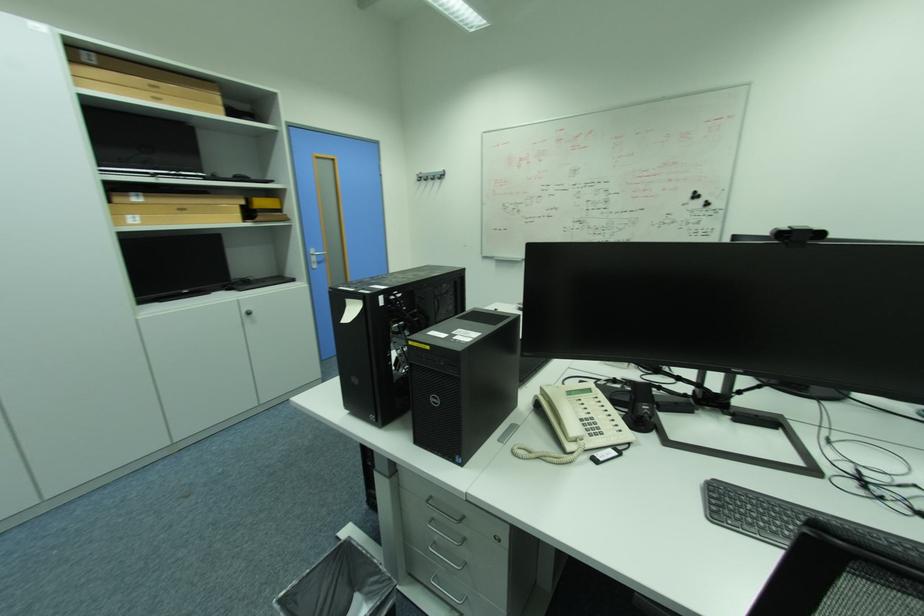
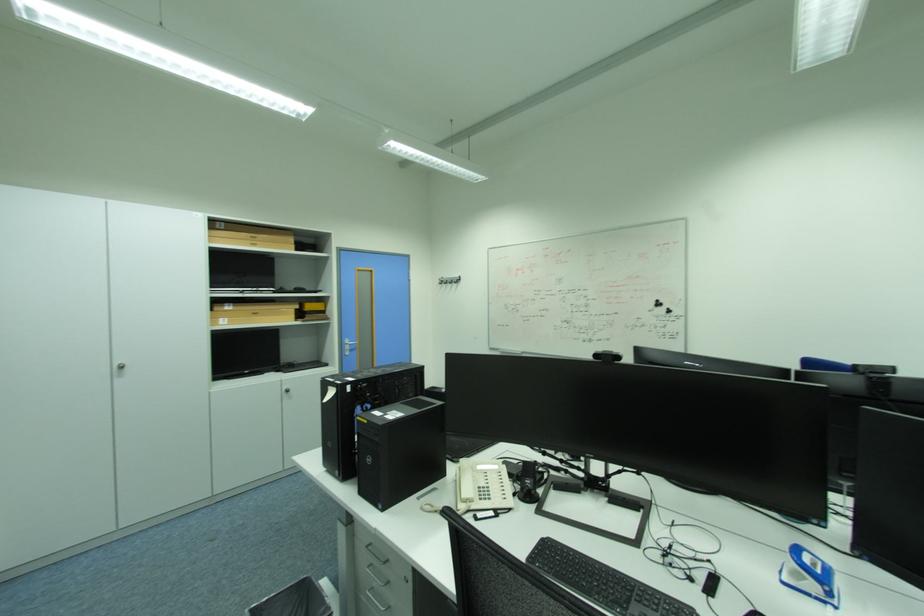
Find the pixel in the second image that matches [427,179] in the first image.

(448, 282)